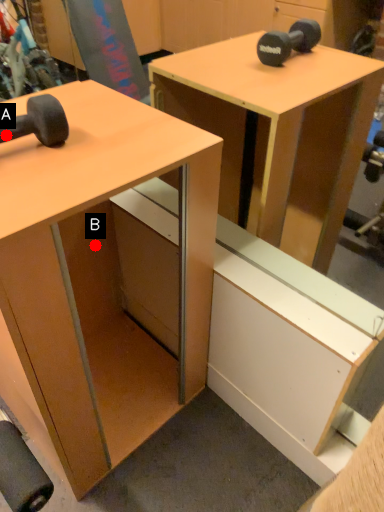
Question: Two points are circled on the image, labeled by A and B beside each circle. Which point is farther from the camera taking this photo?

Choices:
 (A) A is further
 (B) B is further

Answer: (B)